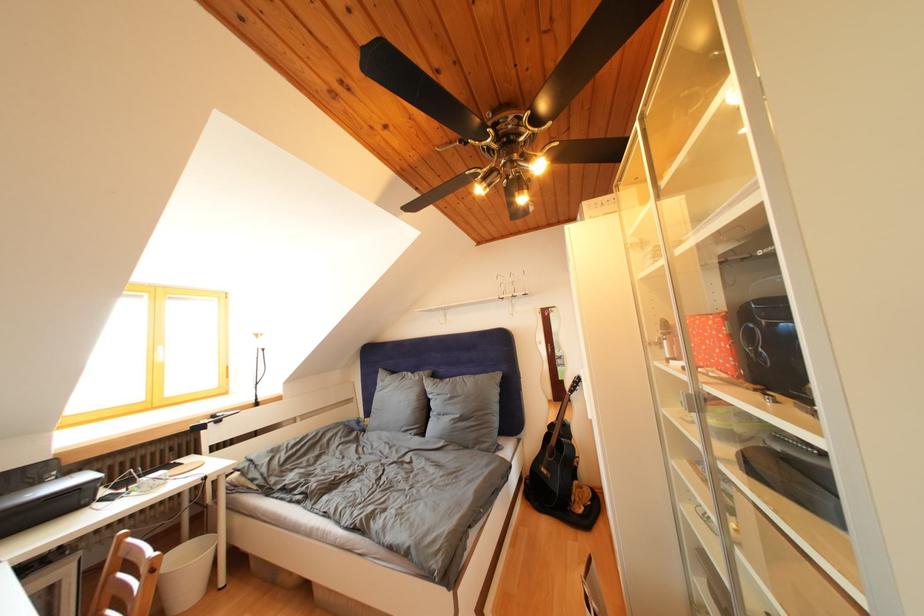
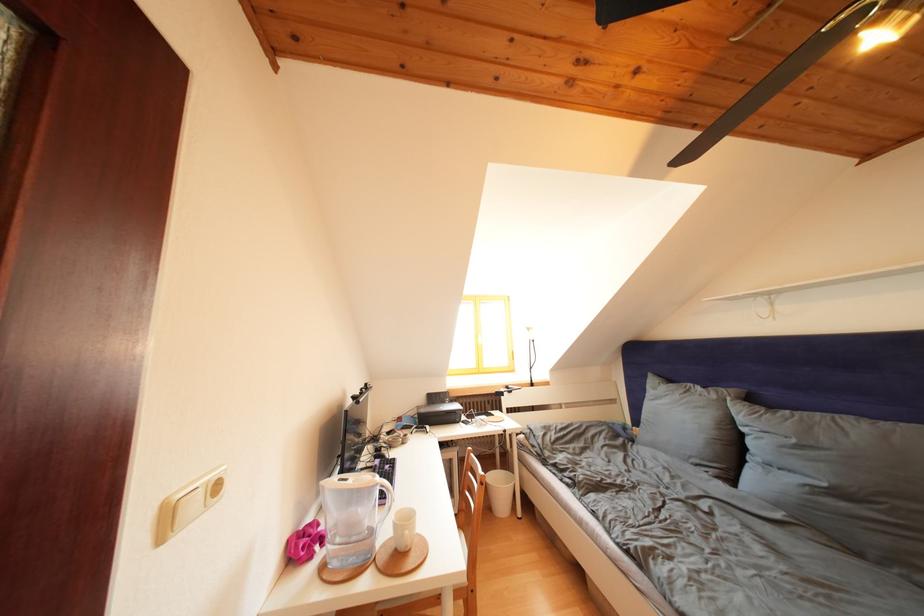
Locate, in the second image, the point that corresponds to [88,560] in the first image.

(466, 454)